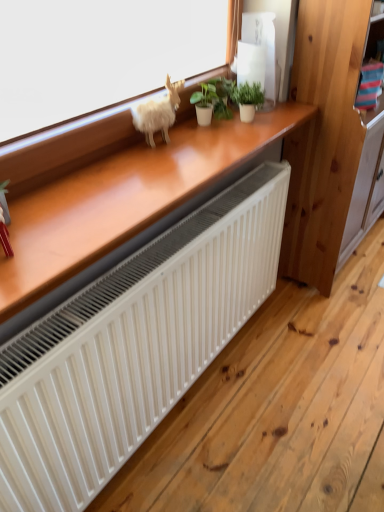
Question: Looking at the image, does green matte plant at center, the second houseplant when ordered from right to left, seem bigger or smaller compared to white matte radiator at lower center?

Choices:
 (A) small
 (B) big

Answer: (A)

Question: Relative to white matte radiator at lower center, is green matte plant at center, arranged as the first houseplant when viewed from the left, in front or behind?

Choices:
 (A) front
 (B) behind

Answer: (B)

Question: Estimate the real-world distances between objects in this image. Which object is closer to the fuzzy white animal at upper center?

Choices:
 (A) green matte plant at center, arranged as the first houseplant when viewed from the left
 (B) wooden dresser at right
 (C) white matte radiator at lower center
 (D) green matte plant at upper center, placed as the first houseplant when sorted from right to left

Answer: (A)

Question: Which object is the farthest from the green matte plant at upper center, marked as the 2th houseplant in a left-to-right arrangement?

Choices:
 (A) green matte plant at center, the second houseplant when ordered from right to left
 (B) wooden dresser at right
 (C) fuzzy white animal at upper center
 (D) white matte radiator at lower center

Answer: (D)